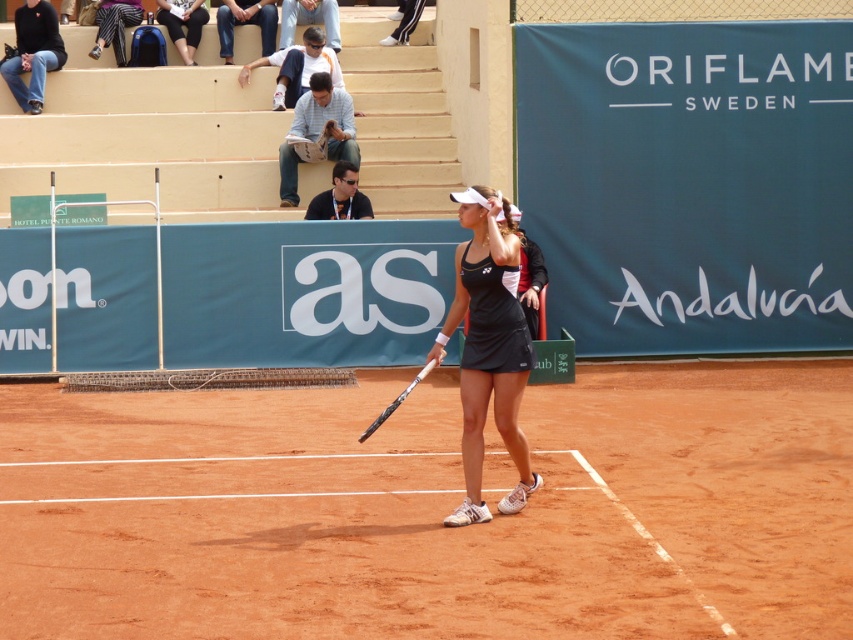
Does brown clay tennis court at center have a lesser width compared to white glossy tennis racket at center?

No.

From the picture: Who is positioned more to the left, brown clay tennis court at center or white glossy tennis racket at center?

From the viewer's perspective, white glossy tennis racket at center appears more on the left side.

Does point (810, 540) lie behind point (421, 369)?

No, it is in front of (421, 369).

Find the location of a particular element. This screenshot has width=853, height=640. brown clay tennis court at center is located at coordinates (433, 509).

In order to click on black matte tennis skirt at center in this screenshot , I will do `click(488, 348)`.

What do you see at coordinates (488, 348) in the screenshot? The height and width of the screenshot is (640, 853). I see `black matte tennis skirt at center` at bounding box center [488, 348].

Where is `black matte tennis skirt at center`? The width and height of the screenshot is (853, 640). black matte tennis skirt at center is located at coordinates (488, 348).

Based on the photo, does brown clay tennis court at center have a greater width compared to black matte tennis skirt at center?

Yes, brown clay tennis court at center is wider than black matte tennis skirt at center.

Locate an element on the screen. brown clay tennis court at center is located at coordinates [x=433, y=509].